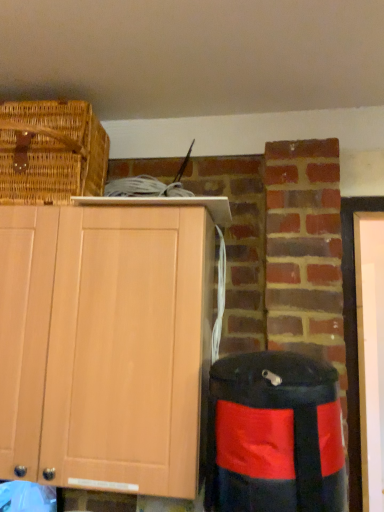
Question: From the image's perspective, is light wood cabinet at upper left located above black fabric trash bin/can at lower right?

Choices:
 (A) yes
 (B) no

Answer: (A)

Question: Is light wood cabinet at upper left turned away from black fabric trash bin/can at lower right?

Choices:
 (A) yes
 (B) no

Answer: (B)

Question: Does light wood cabinet at upper left have a greater height compared to black fabric trash bin/can at lower right?

Choices:
 (A) no
 (B) yes

Answer: (B)

Question: Can you confirm if light wood cabinet at upper left is thinner than black fabric trash bin/can at lower right?

Choices:
 (A) no
 (B) yes

Answer: (A)

Question: Considering the relative sizes of light wood cabinet at upper left and black fabric trash bin/can at lower right in the image provided, is light wood cabinet at upper left smaller than black fabric trash bin/can at lower right?

Choices:
 (A) yes
 (B) no

Answer: (B)

Question: From a real-world perspective, is black fabric trash bin/can at lower right positioned above or below woven brown picnic basket at upper left?

Choices:
 (A) below
 (B) above

Answer: (A)

Question: Is black fabric trash bin/can at lower right taller or shorter than woven brown picnic basket at upper left?

Choices:
 (A) short
 (B) tall

Answer: (B)

Question: Is point (301, 494) closer or farther from the camera than point (6, 138)?

Choices:
 (A) farther
 (B) closer

Answer: (B)

Question: Do you think black fabric trash bin/can at lower right is within woven brown picnic basket at upper left, or outside of it?

Choices:
 (A) inside
 (B) outside

Answer: (B)

Question: Considering the positions of woven brown picnic basket at upper left and light wood cabinet at upper left in the image, is woven brown picnic basket at upper left bigger or smaller than light wood cabinet at upper left?

Choices:
 (A) big
 (B) small

Answer: (B)

Question: From a real-world perspective, is woven brown picnic basket at upper left positioned above or below light wood cabinet at upper left?

Choices:
 (A) below
 (B) above

Answer: (B)

Question: Does point (34, 174) appear closer or farther from the camera than point (89, 301)?

Choices:
 (A) farther
 (B) closer

Answer: (A)

Question: In the image, is woven brown picnic basket at upper left positioned in front of or behind light wood cabinet at upper left?

Choices:
 (A) front
 (B) behind

Answer: (B)

Question: In the image, is light wood cabinet at upper left positioned in front of or behind woven brown picnic basket at upper left?

Choices:
 (A) front
 (B) behind

Answer: (A)

Question: Based on their sizes in the image, would you say light wood cabinet at upper left is bigger or smaller than woven brown picnic basket at upper left?

Choices:
 (A) small
 (B) big

Answer: (B)